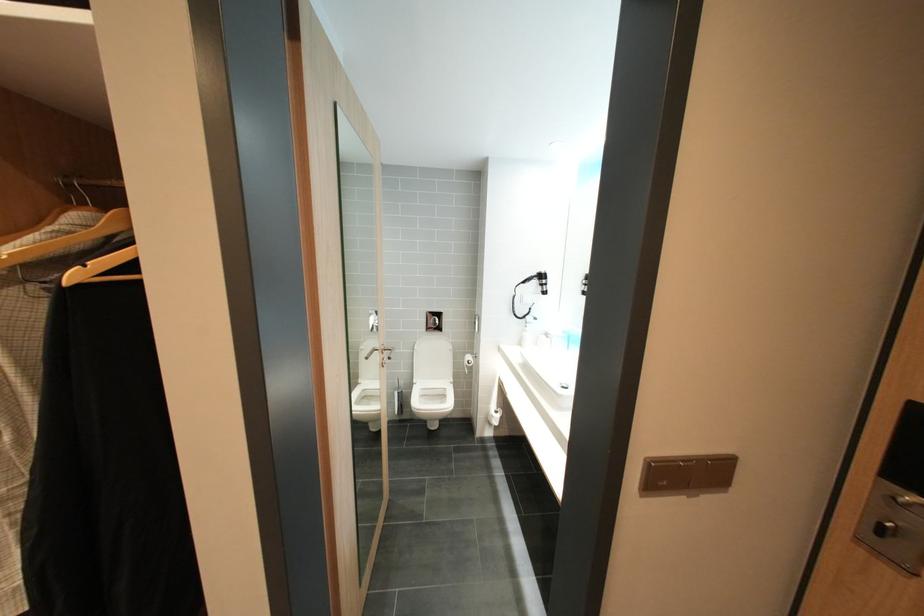
Find the location of a particular element. The width and height of the screenshot is (924, 616). wall-mounted flush button is located at coordinates (433, 321).